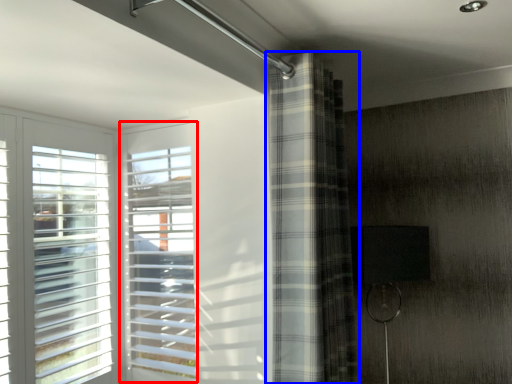
Question: Which object appears farthest to the camera in this image, window (highlighted by a red box) or curtain (highlighted by a blue box)?

Choices:
 (A) window
 (B) curtain

Answer: (A)